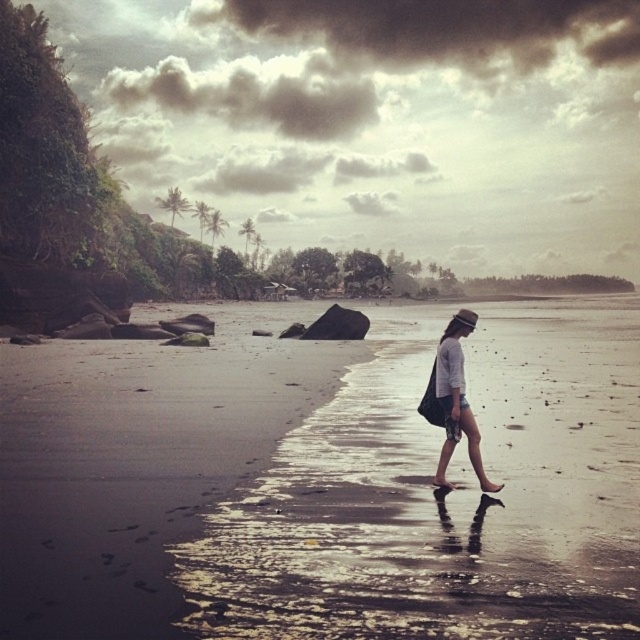
You are a photographer trying to capture the scene from the camera position. The wet sand at center and the matte gray shorts at center are both in your frame. Which object is wider in the image?

The wet sand at center is wider than the matte gray shorts at center.

You are standing on the beach and see the wet sand at center and the matte gray shorts at center. Which object is closer to you?

The wet sand at center is closer to you because it is in front of the matte gray shorts at center.